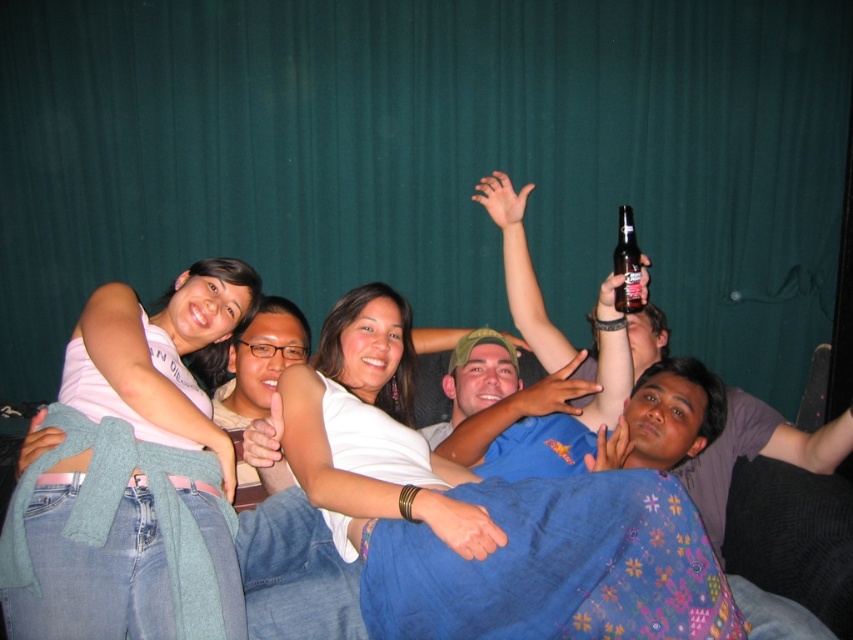
Consider the image. Which is below, white matte tank top at center or clear glass bottle at upper right?

white matte tank top at center

Who is taller, white matte tank top at center or clear glass bottle at upper right?

With more height is white matte tank top at center.

The image size is (853, 640). Identify the location of white matte tank top at center. (132, 477).